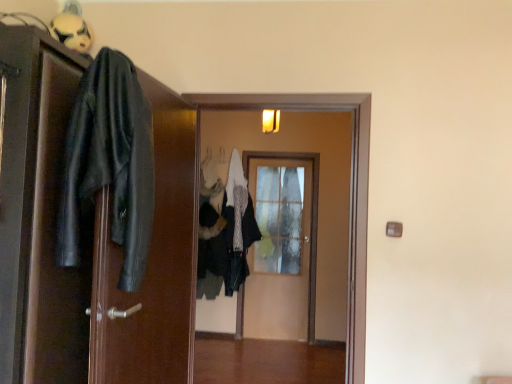
The height and width of the screenshot is (384, 512). Find the location of `free space above wooden door at center, placed as the 2th door when sorted from front to back (from a real-world perspective)`. free space above wooden door at center, placed as the 2th door when sorted from front to back (from a real-world perspective) is located at coordinates (271, 89).